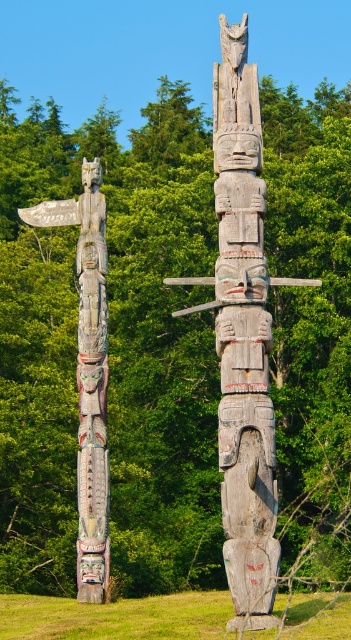
You are standing in front of two totem poles in the image. The weathered wood totem pole at center and the carved wooden totem pole at left. Which one is closer to your left side?

The carved wooden totem pole at left is closer to your left side because it is positioned to the left of the weathered wood totem pole at center.

You are an artist planning to sketch the two totem poles. You notice the weathered wood totem pole at center and the carved wooden totem pole at left. Which of these two totem poles is positioned higher in the image?

The weathered wood totem pole at center is positioned higher in the image than the carved wooden totem pole at left because the description states it is above the latter.